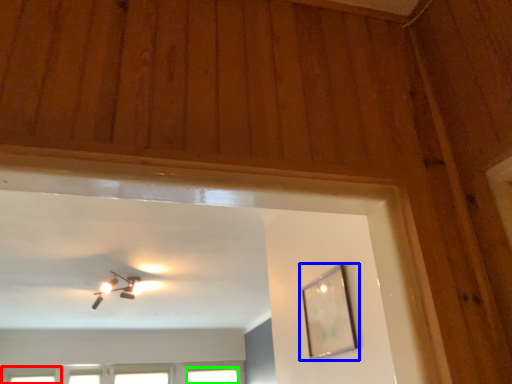
Question: Considering the real-world distances, which object is closest to window (highlighted by a red box)? picture frame (highlighted by a blue box) or window (highlighted by a green box).

Choices:
 (A) picture frame
 (B) window

Answer: (B)